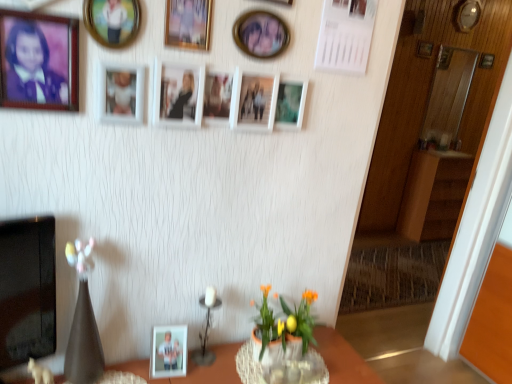
Describe the element at coordinates (467, 15) in the screenshot. I see `wooden clock at upper right, which is counted as the 2th picture frame, starting from the back` at that location.

Find the location of a particular element. wooden clock at upper right, arranged as the 1th picture frame when viewed from the top is located at coordinates (467, 15).

The image size is (512, 384). I want to click on wooden picture frame at upper right, which is the 3th picture frame in right-to-left order, so click(x=424, y=49).

Which is correct: gold-framed picture at upper center, placed as the 10th picture frame when sorted from bottom to top, is inside matte wooden picture frame at upper left, which is the thirteenth picture frame from back to front, or outside of it?

gold-framed picture at upper center, placed as the 10th picture frame when sorted from bottom to top, exists outside the volume of matte wooden picture frame at upper left, which is the thirteenth picture frame from back to front.

Considering the positions of objects gold-framed picture at upper center, acting as the sixth picture frame starting from the left, and matte wooden picture frame at upper left, positioned as the 1th picture frame in left-to-right order, in the image provided, who is more to the left, gold-framed picture at upper center, acting as the sixth picture frame starting from the left, or matte wooden picture frame at upper left, positioned as the 1th picture frame in left-to-right order,?

Positioned to the left is matte wooden picture frame at upper left, positioned as the 1th picture frame in left-to-right order.

Is the position of gold-framed picture at upper center, marked as the 8th picture frame in a right-to-left arrangement, less distant than that of matte wooden picture frame at upper left, positioned as the 1th picture frame in left-to-right order?

No.

How far apart are orange artificial flowers at lower center and wooden table at lower center?

They are 8.18 inches apart.

Is orange artificial flowers at lower center looking in the opposite direction of wooden table at lower center?

That's not correct — orange artificial flowers at lower center is not looking away from wooden table at lower center.

Is orange artificial flowers at lower center shorter than wooden table at lower center?

Indeed, orange artificial flowers at lower center has a lesser height compared to wooden table at lower center.

Which of these two, orange artificial flowers at lower center or wooden table at lower center, is thinner?

With smaller width is orange artificial flowers at lower center.

Choose the correct answer: Is gold-framed picture at upper center, marked as the 8th picture frame in a right-to-left arrangement, inside matte white photo frame at lower center, which is counted as the 4th picture frame, starting from the left, or outside it?

The correct answer is: outside.

From the picture: Is gold-framed picture at upper center, acting as the sixth picture frame starting from the left, not close to matte white photo frame at lower center, which appears as the first picture frame when ordered from the bottom?

gold-framed picture at upper center, acting as the sixth picture frame starting from the left, is positioned a significant distance from matte white photo frame at lower center, which appears as the first picture frame when ordered from the bottom.

Considering the relative sizes of gold-framed picture at upper center, which is the 4th picture frame in top-to-bottom order, and matte white photo frame at lower center, which ranks as the 13th picture frame in top-to-bottom order, in the image provided, is gold-framed picture at upper center, which is the 4th picture frame in top-to-bottom order, taller than matte white photo frame at lower center, which ranks as the 13th picture frame in top-to-bottom order,?

Yes, gold-framed picture at upper center, which is the 4th picture frame in top-to-bottom order, is taller than matte white photo frame at lower center, which ranks as the 13th picture frame in top-to-bottom order.

In the image, is gold-framed picture at upper center, placed as the 10th picture frame when sorted from bottom to top, on the left side or the right side of matte white photo frame at lower center, which is counted as the 4th picture frame, starting from the left?

In the image, gold-framed picture at upper center, placed as the 10th picture frame when sorted from bottom to top, appears on the right side of matte white photo frame at lower center, which is counted as the 4th picture frame, starting from the left.

Is metallic circular frame at upper left, positioned as the 8th picture frame in bottom-to-top order, inside the boundaries of matte white photo frame at lower center, which is counted as the 4th picture frame, starting from the left, or outside?

metallic circular frame at upper left, positioned as the 8th picture frame in bottom-to-top order, is located beyond the bounds of matte white photo frame at lower center, which is counted as the 4th picture frame, starting from the left.

From the image's perspective, is metallic circular frame at upper left, the third picture frame from the left, under matte white photo frame at lower center, which appears as the first picture frame when ordered from the bottom?

Actually, metallic circular frame at upper left, the third picture frame from the left, appears above matte white photo frame at lower center, which appears as the first picture frame when ordered from the bottom, in the image.

Does metallic circular frame at upper left, the third picture frame from the left, appear on the left side of matte white photo frame at lower center, the 9th picture frame positioned from the front?

Yes.

Which of these two, metallic circular frame at upper left, marked as the sixth picture frame in a top-to-bottom arrangement, or matte white photo frame at lower center, which is the tenth picture frame in right-to-left order, is smaller?

With smaller size is metallic circular frame at upper left, marked as the sixth picture frame in a top-to-bottom arrangement.

Is brown wood dresser at right spatially inside wooden picture frame at upper center, which is counted as the eighth picture frame, starting from the back, or outside of it?

brown wood dresser at right lies outside wooden picture frame at upper center, which is counted as the eighth picture frame, starting from the back.

Which of these two, brown wood dresser at right or wooden picture frame at upper center, the fifth picture frame positioned from the right, stands taller?

brown wood dresser at right.

From a real-world perspective, who is located higher, brown wood dresser at right or wooden picture frame at upper center, the ninth picture frame from the bottom?

In real-world perspective, wooden picture frame at upper center, the ninth picture frame from the bottom, is above.

In the image, is brown wood dresser at right positioned in front of or behind wooden picture frame at upper center, positioned as the 6th picture frame in front-to-back order?

In the image, brown wood dresser at right appears behind wooden picture frame at upper center, positioned as the 6th picture frame in front-to-back order.

How distant is matte wooden picture frame at upper left, which ranks as the 7th picture frame in top-to-bottom order, from metallic silver picture frame at upper center, positioned as the fourth picture frame in back-to-front order?

They are 29.84 inches apart.

Based on the photo, which object is positioned more to the right, matte wooden picture frame at upper left, which ranks as the 1th picture frame in front-to-back order, or metallic silver picture frame at upper center, arranged as the ninth picture frame when viewed from the top?

Positioned to the right is metallic silver picture frame at upper center, arranged as the ninth picture frame when viewed from the top.

Does point (16, 81) appear closer or farther from the camera than point (300, 87)?

Point (16, 81) appears to be closer to the viewer than point (300, 87).

Is matte wooden picture frame at upper left, acting as the 7th picture frame starting from the bottom, positioned beyond the bounds of metallic silver picture frame at upper center, arranged as the ninth picture frame when viewed from the top?

Indeed, matte wooden picture frame at upper left, acting as the 7th picture frame starting from the bottom, is completely outside metallic silver picture frame at upper center, arranged as the ninth picture frame when viewed from the top.

Does point (261, 371) come closer to viewer compared to point (422, 230)?

Yes.

Is clear glass vase at lower center completely or partially outside of brown wood dresser at right?

Yes, clear glass vase at lower center is not within brown wood dresser at right.

Identify the location of glass vase below the brown wood dresser at right (from the image's perspective). (296, 370).

Is clear glass vase at lower center turned away from brown wood dresser at right?

No.

Identify the location of the 3rd picture frame directly beneath the gold-framed picture at upper center, acting as the sixth picture frame starting from the left (from a real-world perspective). This screenshot has height=384, width=512. (39, 61).

You are a GUI agent. You are given a task and a screenshot of the screen. Output one action in this format:
    pyautogui.click(x=<x>, y=<y>)
    Task: Click on the floral arrangement that appears above the wooden table at lower center (from the image's perspective)
    The image size is (512, 384).
    Given the screenshot: What is the action you would take?
    pyautogui.click(x=282, y=345)

When comparing their distances from matte white photo frame at lower center, the 9th picture frame positioned from the front, does metallic silver picture frame at upper center, placed as the 5th picture frame when sorted from bottom to top, or matte black vase at left seem closer?

matte black vase at left lies closer to matte white photo frame at lower center, the 9th picture frame positioned from the front, than the other object.

Considering their positions, is metallic silver picture frame at upper center, placed as the 5th picture frame when sorted from bottom to top, positioned closer to white matte picture frame at center, which is the sixth picture frame from right to left, than wooden clock at upper right, the 12th picture frame positioned from the front?

The object closer to white matte picture frame at center, which is the sixth picture frame from right to left, is metallic silver picture frame at upper center, placed as the 5th picture frame when sorted from bottom to top.

From the image, which object appears to be farther from metallic silver candle holder at center, gold-framed picture at upper center, acting as the sixth picture frame starting from the left, or matte black vase at left?

gold-framed picture at upper center, acting as the sixth picture frame starting from the left, is positioned further to the anchor metallic silver candle holder at center.

Estimate the real-world distances between objects in this image. Which object is closer to orange artificial flowers at lower center, clear glass vase at lower center or white matte picture frame at center, the 8th picture frame when ordered from front to back?

clear glass vase at lower center is closer to orange artificial flowers at lower center.

Looking at the image, which one is located closer to wooden picture frame at upper center, the ninth picture frame from the bottom, matte wooden picture frame at upper left, positioned as the 1th picture frame in left-to-right order, or white matte picture frame at center, placed as the sixth picture frame when sorted from back to front?

Based on the image, white matte picture frame at center, placed as the sixth picture frame when sorted from back to front, appears to be nearer to wooden picture frame at upper center, the ninth picture frame from the bottom.

Consider the image. When comparing their distances from wooden clock at upper right, the second picture frame when ordered from right to left, does wooden picture frame at upper right, the 11th picture frame in the front-to-back sequence, or brown wood dresser at right seem closer?

wooden picture frame at upper right, the 11th picture frame in the front-to-back sequence, is closer to wooden clock at upper right, the second picture frame when ordered from right to left.

Considering their positions, is wooden picture frame at upper right, positioned as the 11th picture frame in left-to-right order, positioned closer to matte wooden picture frame at center, placed as the seventh picture frame when sorted from front to back, than gold-framed picture at upper center, acting as the sixth picture frame starting from the left?

gold-framed picture at upper center, acting as the sixth picture frame starting from the left.

Which object lies further to the anchor point matte white picture frame at upper center, which is the 12th picture frame in right-to-left order, metallic silver picture frame at upper center, which ranks as the 10th picture frame in front-to-back order, or wooden table at lower center?

wooden table at lower center.

Locate an element on the screen. Image resolution: width=512 pixels, height=384 pixels. vase between wooden table at lower center and wooden picture frame at upper right, acting as the thirteenth picture frame starting from the front, from front to back is located at coordinates (84, 342).

Where is `floral arrangement between metallic silver candle holder at center and wooden picture frame at upper right, the 2th picture frame viewed from the top, in the front-back direction`? floral arrangement between metallic silver candle holder at center and wooden picture frame at upper right, the 2th picture frame viewed from the top, in the front-back direction is located at coordinates (282, 345).

You are a GUI agent. You are given a task and a screenshot of the screen. Output one action in this format:
    pyautogui.click(x=<x>, y=<y>)
    Task: Click on the vase between matte white picture frame at upper center, the third picture frame when ordered from front to back, and orange artificial flowers at lower center from top to bottom
    This screenshot has height=384, width=512.
    Given the screenshot: What is the action you would take?
    pyautogui.click(x=84, y=342)

Image resolution: width=512 pixels, height=384 pixels. Identify the location of candle holder between wooden picture frame at upper center, which is counted as the eighth picture frame, starting from the back, and clear glass vase at lower center from top to bottom. (206, 328).